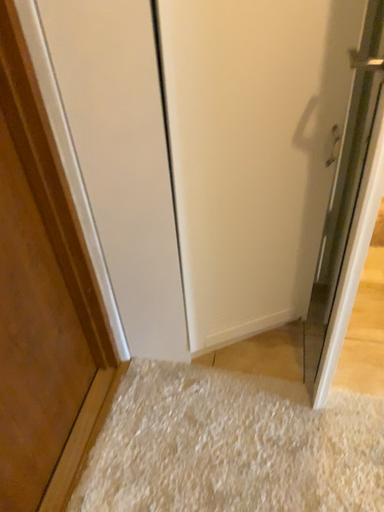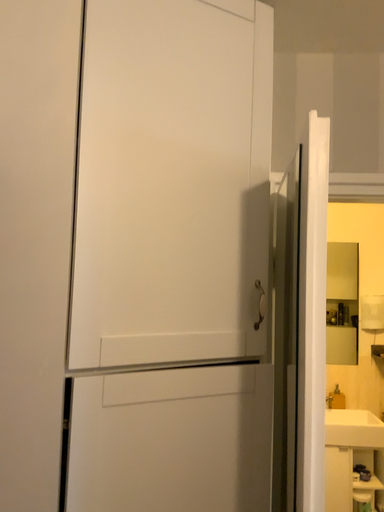
Question: Which way did the camera rotate in the video?

Choices:
 (A) rotated downward
 (B) rotated upward

Answer: (B)